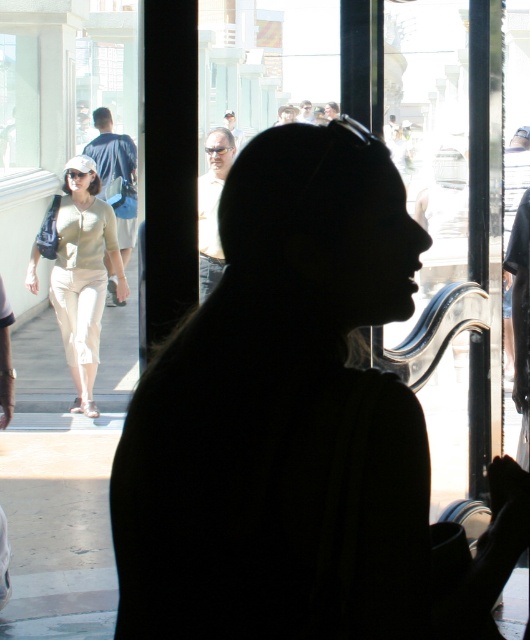
Between smooth black shirt at center and matte beige shirt at center, which one has less height?

matte beige shirt at center is shorter.

Can you confirm if smooth black shirt at center is positioned to the right of matte beige shirt at center?

Yes, smooth black shirt at center is to the right of matte beige shirt at center.

Locate an element on the screen. The height and width of the screenshot is (640, 530). smooth black shirt at center is located at coordinates (517, 259).

Identify the location of smooth black shirt at center. The image size is (530, 640). (517, 259).

Can you confirm if smooth black shirt at center is taller than blue denim jacket at left?

Yes.

Identify the location of smooth black shirt at center. This screenshot has width=530, height=640. click(517, 259).

At what (x,y) coordinates should I click in order to perform the action: click on smooth black shirt at center. Please return your answer as a coordinate pair (x, y). The image size is (530, 640). Looking at the image, I should click on tap(517, 259).

Who is more forward, (96, 355) or (222, 252)?

Point (222, 252) is more forward.

From the picture: Can you confirm if beige cotton pants at left is thinner than matte beige shirt at center?

Incorrect, beige cotton pants at left's width is not less than matte beige shirt at center's.

Which is behind, point (73, 412) or point (215, 177)?

The point (73, 412) is behind.

You are a GUI agent. You are given a task and a screenshot of the screen. Output one action in this format:
    pyautogui.click(x=<x>, y=<y>)
    Task: Click on the beige cotton pants at left
    The height and width of the screenshot is (640, 530).
    Given the screenshot: What is the action you would take?
    pyautogui.click(x=83, y=275)